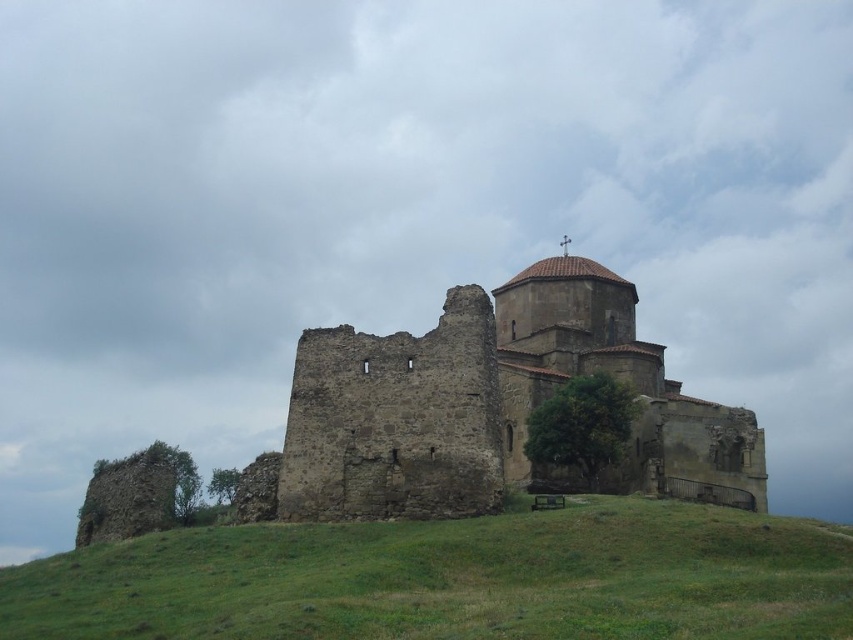
You are standing at the base of the hill where the green grassy hillside at lower center is located. You want to climb up to the ruins and the intact building on top. Considering the distance from where you are standing to the base of the hill, do you think you can reach the top in 10 minutes if you walk at a normal pace?

The green grassy hillside at lower center is 32.96 meters away from the camera. Assuming the distance to the base of the hill is part of this measurement, the total climb would be approximately 32.96 meters. Walking at a normal pace, covering 1.4 meters per second, it would take roughly 23.5 seconds to reach the base. From there, climbing the hill itself would depend on its slope and your stamina, but the horizontal distance is short. You should be able to reach the top in under 10 minutes.

You are standing at the base of the hill looking up at the green grassy hillside at lower center and the rustic stone castle at center. Which area covers a smaller portion of the image?

The green grassy hillside at lower center occupies less space than the rustic stone castle at center, so the green grassy hillside at lower center covers a smaller portion of the image.

Consider the image. You are a tourist standing at the base of the hill looking up at the historical site. You see the green grassy hillside at lower center and the rustic stone castle at center. Which object is positioned to the left side from your perspective?

The green grassy hillside at lower center is to the left of rustic stone castle at center, so the green grassy hillside at lower center is positioned to the left side from your perspective.